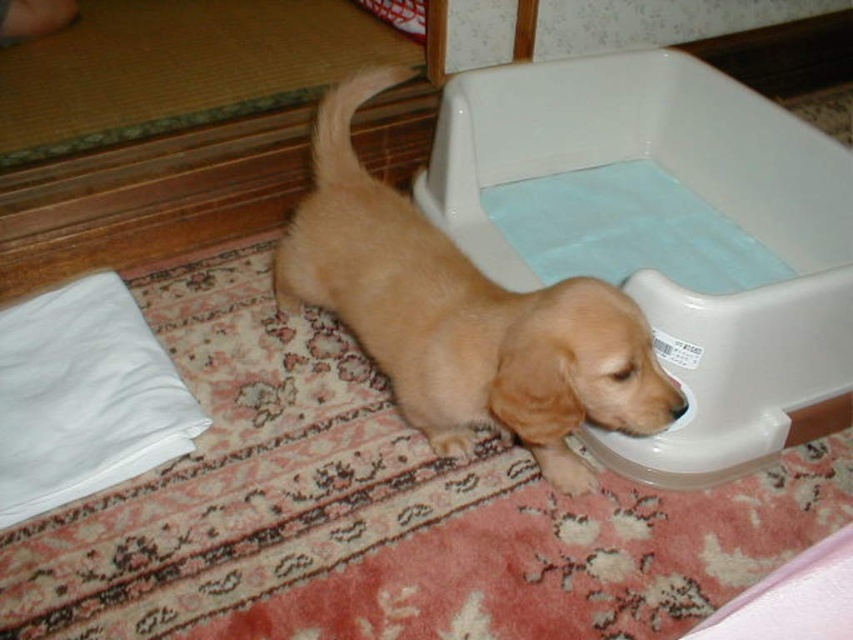
Question: Which point is closer to the camera?

Choices:
 (A) (846, 209)
 (B) (349, 116)

Answer: (B)

Question: Which object appears closest to the camera in this image?

Choices:
 (A) golden fur dog at center
 (B) white plastic tub at lower right

Answer: (A)

Question: Does white plastic tub at lower right have a lesser width compared to golden fur dog at center?

Choices:
 (A) no
 (B) yes

Answer: (A)

Question: Can you confirm if white plastic tub at lower right is thinner than golden fur dog at center?

Choices:
 (A) no
 (B) yes

Answer: (A)

Question: Does white plastic tub at lower right appear on the left side of golden fur dog at center?

Choices:
 (A) yes
 (B) no

Answer: (B)